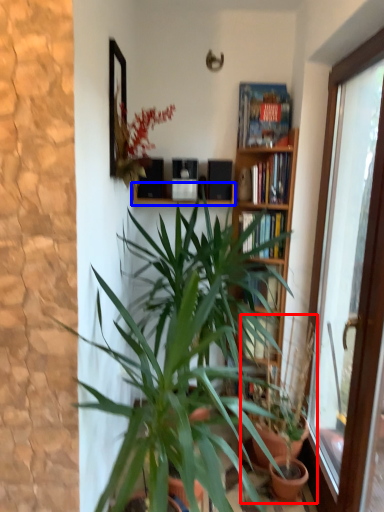
Question: Which of the following is the farthest to the observer, houseplant (highlighted by a red box) or window sill (highlighted by a blue box)?

Choices:
 (A) houseplant
 (B) window sill

Answer: (B)